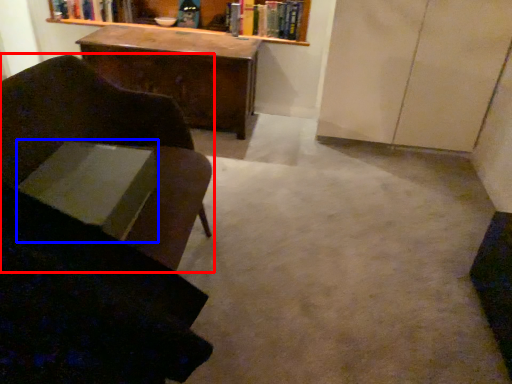
Question: Which object appears closest to the camera in this image, chair (highlighted by a red box) or book (highlighted by a blue box)?

Choices:
 (A) chair
 (B) book

Answer: (A)